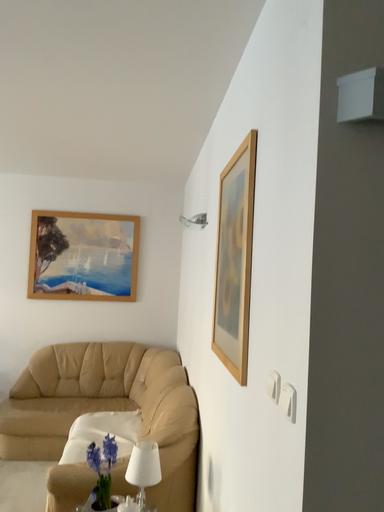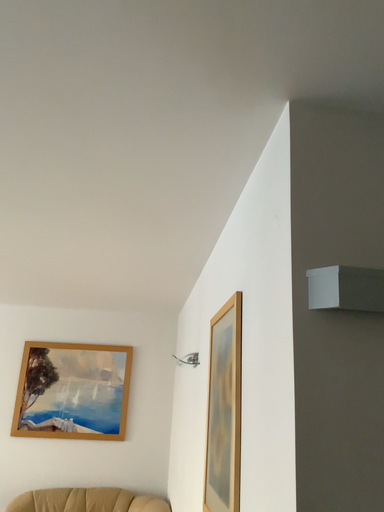
Question: How did the camera likely rotate when shooting the video?

Choices:
 (A) rotated upward
 (B) rotated downward

Answer: (A)